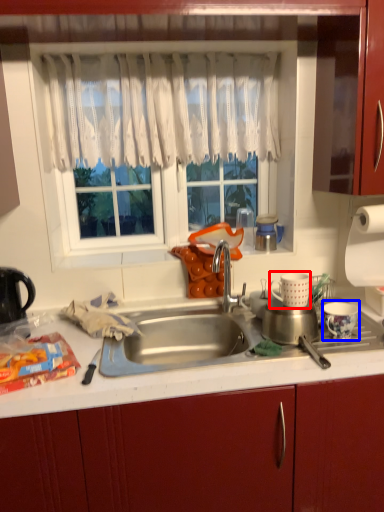
Question: Which object is closer to the camera taking this photo, appliance (highlighted by a red box) or appliance (highlighted by a blue box)?

Choices:
 (A) appliance
 (B) appliance

Answer: (B)